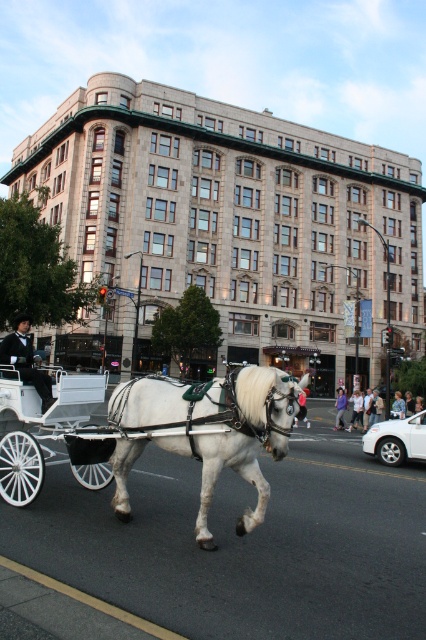
You are standing on the sidewalk and see both the white polished wood cart at center and the white leather coach at center. Which one appears nearer to you?

The white polished wood cart at center appears nearer to you because it is closer to the viewer than the white leather coach at center.